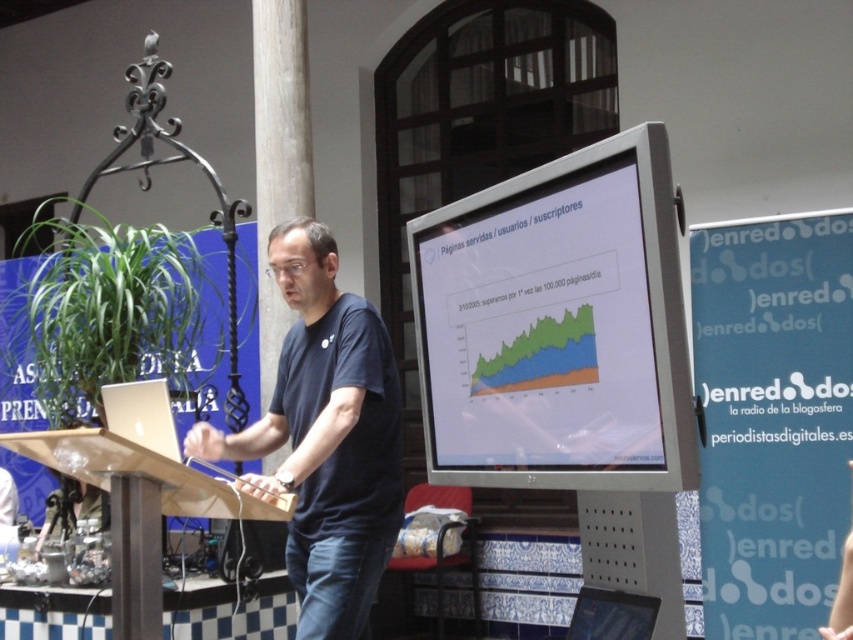
Question: Is matte plastic monitor at center smaller than wooden podium at center?

Choices:
 (A) no
 (B) yes

Answer: (A)

Question: Is matte plastic monitor at center positioned before dark blue t-shirt at center?

Choices:
 (A) no
 (B) yes

Answer: (B)

Question: Which point appears closest to the camera in this image?

Choices:
 (A) (541, 232)
 (B) (770, 413)
 (C) (306, 541)

Answer: (A)

Question: Which of the following is the farthest from the observer?

Choices:
 (A) wooden podium at center
 (B) blue glossy projection screen at center
 (C) matte plastic monitor at center
 (D) dark blue t-shirt at center

Answer: (B)

Question: Is blue glossy projection screen at center closer to camera compared to wooden podium at center?

Choices:
 (A) no
 (B) yes

Answer: (A)

Question: Which point is closer to the camera taking this photo?

Choices:
 (A) (607, 168)
 (B) (770, 547)
 (C) (22, 444)
 (D) (357, 621)

Answer: (A)